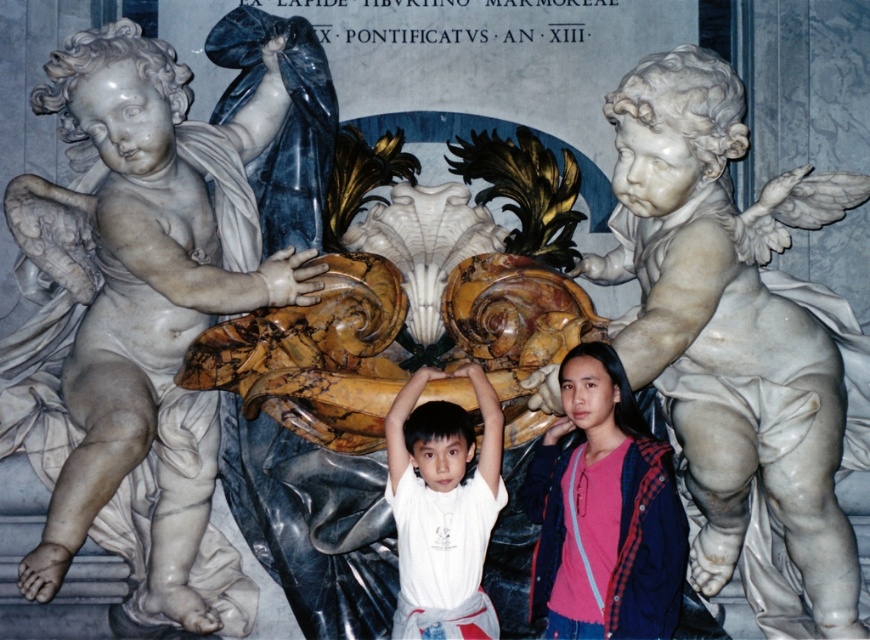
Question: Among these objects, which one is farthest from the camera?

Choices:
 (A) white matte shirt at center
 (B) white marble cherub at left

Answer: (B)

Question: Which point is closer to the camera?

Choices:
 (A) white marble cherub at upper right
 (B) pink fabric at center
 (C) white matte shirt at center
 (D) white marble cherub at left

Answer: (B)

Question: Which point is closer to the camera?

Choices:
 (A) white marble cherub at upper right
 (B) pink fabric at center

Answer: (B)

Question: Is white marble cherub at upper right further to camera compared to pink fabric at center?

Choices:
 (A) yes
 (B) no

Answer: (A)

Question: Does white marble cherub at upper right have a smaller size compared to pink fabric at center?

Choices:
 (A) yes
 (B) no

Answer: (B)

Question: Is white marble cherub at upper right wider than pink fabric at center?

Choices:
 (A) no
 (B) yes

Answer: (B)